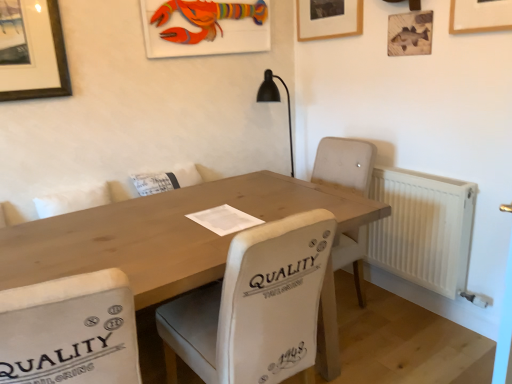
Question: Can you confirm if white fabric chair at center, which is the first chair in right-to-left order, is smaller than wooden fish at upper right, which is the 3th picture frame in left-to-right order?

Choices:
 (A) no
 (B) yes

Answer: (A)

Question: Can you confirm if white fabric chair at center, which is the first chair in right-to-left order, is taller than wooden fish at upper right, the 1th picture frame positioned from the right?

Choices:
 (A) yes
 (B) no

Answer: (A)

Question: Is wooden fish at upper right, the 1th picture frame positioned from the right, inside white fabric chair at center, which is the first chair in right-to-left order?

Choices:
 (A) no
 (B) yes

Answer: (A)

Question: From a real-world perspective, is white fabric chair at center, which is the second chair in left-to-right order, below wooden fish at upper right, the 1th picture frame positioned from the right?

Choices:
 (A) yes
 (B) no

Answer: (A)

Question: Does white fabric chair at center, which is the first chair in right-to-left order, have a larger size compared to wooden fish at upper right, the 1th picture frame positioned from the right?

Choices:
 (A) no
 (B) yes

Answer: (B)

Question: From the image's perspective, is white fabric chair at lower left, the 2th chair positioned from the right, above or below wooden lobster at upper center, which ranks as the 3th picture frame in right-to-left order?

Choices:
 (A) below
 (B) above

Answer: (A)

Question: Is white fabric chair at lower left, the 2th chair positioned from the right, wider or thinner than wooden lobster at upper center, which ranks as the 3th picture frame in right-to-left order?

Choices:
 (A) thin
 (B) wide

Answer: (B)

Question: From a real-world perspective, is white fabric chair at lower left, which is the first chair from left to right, physically located above or below wooden lobster at upper center, which ranks as the 3th picture frame in right-to-left order?

Choices:
 (A) above
 (B) below

Answer: (B)

Question: Do you think white fabric chair at lower left, which is the first chair from left to right, is within wooden lobster at upper center, positioned as the 1th picture frame in left-to-right order, or outside of it?

Choices:
 (A) inside
 (B) outside

Answer: (B)

Question: Is point (217, 374) closer or farther from the camera than point (224, 28)?

Choices:
 (A) closer
 (B) farther

Answer: (A)

Question: From a real-world perspective, is white fabric chair at center, which is the second chair in left-to-right order, physically located above or below wooden lobster at upper center, which ranks as the 3th picture frame in right-to-left order?

Choices:
 (A) below
 (B) above

Answer: (A)

Question: In the image, is white fabric chair at center, which is the first chair in right-to-left order, positioned in front of or behind wooden lobster at upper center, which ranks as the 3th picture frame in right-to-left order?

Choices:
 (A) behind
 (B) front

Answer: (B)

Question: In terms of width, does white fabric chair at center, which is the first chair in right-to-left order, look wider or thinner when compared to wooden lobster at upper center, positioned as the 1th picture frame in left-to-right order?

Choices:
 (A) thin
 (B) wide

Answer: (B)

Question: From a real-world perspective, is natural wood table at center positioned above or below wooden fish at upper right, the 1th picture frame positioned from the right?

Choices:
 (A) above
 (B) below

Answer: (B)

Question: Which is correct: natural wood table at center is inside wooden fish at upper right, the 1th picture frame positioned from the right, or outside of it?

Choices:
 (A) outside
 (B) inside

Answer: (A)